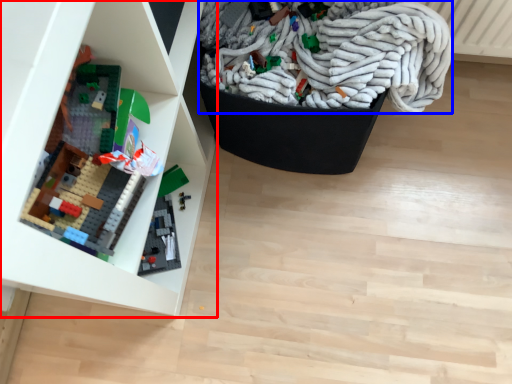
Question: Which object appears closest to the camera in this image, shelf (highlighted by a red box) or wrap (highlighted by a blue box)?

Choices:
 (A) shelf
 (B) wrap

Answer: (A)